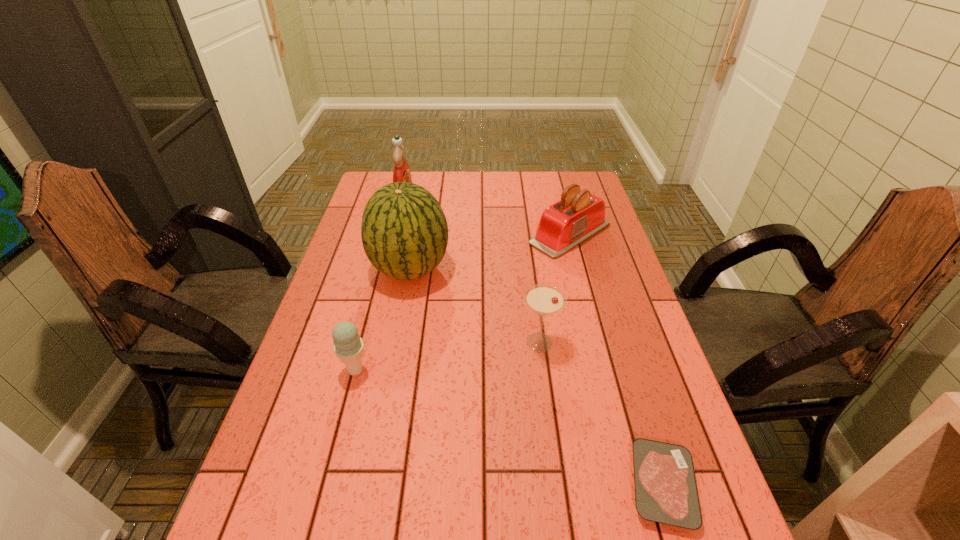
Locate an element on the screen. vacant space at the far edge is located at coordinates (412, 179).

The width and height of the screenshot is (960, 540). I want to click on vacant space at the left edge, so click(x=345, y=321).

Identify the location of vacant space at the right edge of the desktop. The image size is (960, 540). (706, 478).

You are a GUI agent. You are given a task and a screenshot of the screen. Output one action in this format:
    pyautogui.click(x=<x>, y=<y>)
    Task: Click on the unoccupied area between the watermelon and the nearest object
    
    Given the screenshot: What is the action you would take?
    coord(536,377)

Find the location of a particular element. This screenshot has height=540, width=960. free space between the nearest object and the watermelon is located at coordinates (536, 377).

This screenshot has height=540, width=960. Identify the location of free space between the toaster and the steak. (616, 360).

You are a GUI agent. You are given a task and a screenshot of the screen. Output one action in this format:
    pyautogui.click(x=<x>, y=<y>)
    Task: Click on the free space between the ice cream and the detergent
    This screenshot has height=540, width=960.
    Given the screenshot: What is the action you would take?
    pyautogui.click(x=380, y=286)

Find the location of a particular element. This screenshot has width=960, height=540. free spot between the steak and the watermelon is located at coordinates (536, 377).

Where is `free area in between the fourth farthest object and the nearest object`? Image resolution: width=960 pixels, height=540 pixels. free area in between the fourth farthest object and the nearest object is located at coordinates pos(601,414).

Where is `free space between the fourth farthest object and the ice cream`? This screenshot has height=540, width=960. free space between the fourth farthest object and the ice cream is located at coordinates (447, 356).